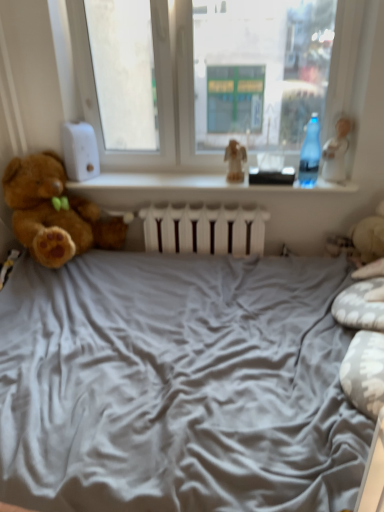
Question: From a real-world perspective, does transparent plastic bottle at upper center stand above transparent plastic bottle at right?

Choices:
 (A) no
 (B) yes

Answer: (A)

Question: Is transparent plastic bottle at upper center shorter than transparent plastic bottle at right?

Choices:
 (A) yes
 (B) no

Answer: (A)

Question: Does transparent plastic bottle at upper center appear on the right side of transparent plastic bottle at right?

Choices:
 (A) yes
 (B) no

Answer: (B)

Question: Is transparent plastic bottle at upper center aimed at transparent plastic bottle at right?

Choices:
 (A) yes
 (B) no

Answer: (B)

Question: Is transparent plastic bottle at upper center oriented away from transparent plastic bottle at right?

Choices:
 (A) yes
 (B) no

Answer: (B)

Question: Is transparent plastic bottle at right inside transparent plastic bottle at upper center?

Choices:
 (A) no
 (B) yes

Answer: (A)

Question: Is transparent plastic bottle at upper center far from white glossy figurine at upper right, the second toy when ordered from left to right?

Choices:
 (A) yes
 (B) no

Answer: (B)

Question: Would you say transparent plastic bottle at upper center contains white glossy figurine at upper right, which is the 1th toy in right-to-left order?

Choices:
 (A) no
 (B) yes

Answer: (A)

Question: Is transparent plastic bottle at upper center smaller than white glossy figurine at upper right, the second toy when ordered from left to right?

Choices:
 (A) no
 (B) yes

Answer: (A)

Question: From the image's perspective, is transparent plastic bottle at upper center on top of white glossy figurine at upper right, which is the 1th toy in right-to-left order?

Choices:
 (A) yes
 (B) no

Answer: (B)

Question: Can you confirm if transparent plastic bottle at upper center is thinner than white glossy figurine at upper right, the second toy when ordered from left to right?

Choices:
 (A) no
 (B) yes

Answer: (A)

Question: Can you confirm if transparent plastic bottle at upper center is bigger than white glossy figurine at upper right, which is the 1th toy in right-to-left order?

Choices:
 (A) yes
 (B) no

Answer: (A)

Question: Does white glossy figurine at upper right, which is the 1th toy in right-to-left order, lie in front of transparent plastic bottle at right?

Choices:
 (A) no
 (B) yes

Answer: (A)